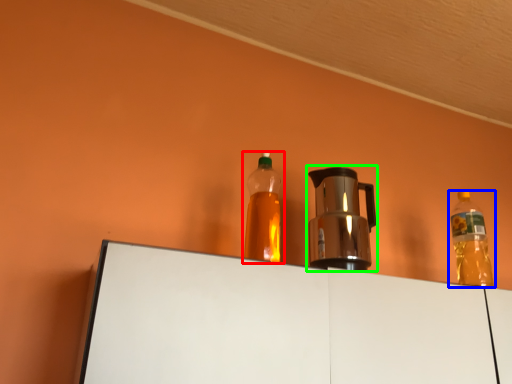
Question: Estimate the real-world distances between objects in this image. Which object is farther from bottle (highlighted by a red box), bottle (highlighted by a blue box) or coffeepot (highlighted by a green box)?

Choices:
 (A) bottle
 (B) coffeepot

Answer: (A)